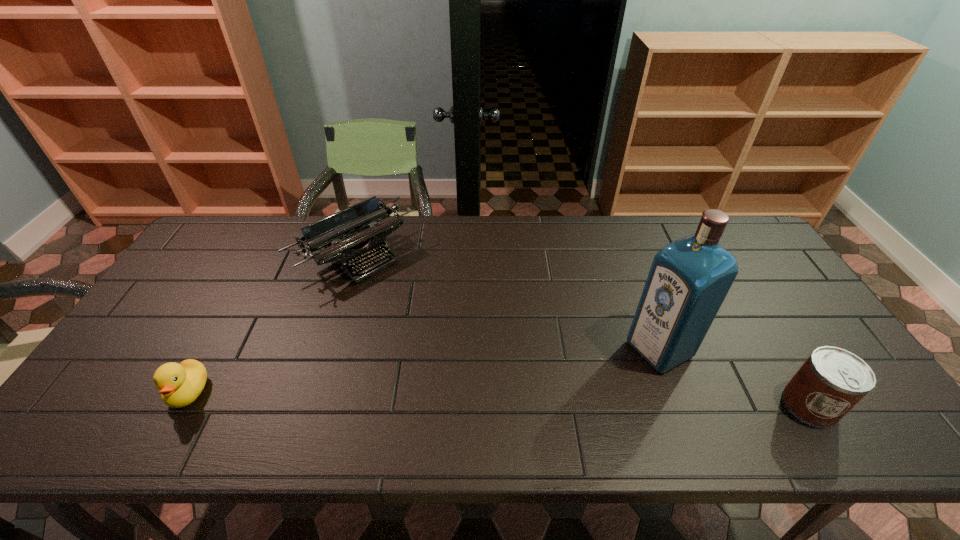
You are a GUI agent. You are given a task and a screenshot of the screen. Output one action in this format:
    pyautogui.click(x=<x>, y=<y>)
    Task: Click on the vacant space at the far edge
    
    Given the screenshot: What is the action you would take?
    pyautogui.click(x=495, y=222)

Locate an element on the screen. free space at the near edge of the desktop is located at coordinates (349, 386).

This screenshot has height=540, width=960. Identify the location of vacant space at the left edge of the desktop. (179, 337).

In the image, there is a desktop. Where is `free space at the right edge`? This screenshot has height=540, width=960. free space at the right edge is located at coordinates (780, 327).

Image resolution: width=960 pixels, height=540 pixels. I want to click on blank area at the far left corner, so [235, 235].

Locate an element on the screen. free region at the near left corner is located at coordinates (128, 403).

This screenshot has width=960, height=540. What are the coordinates of `vacant space at the far right corner` in the screenshot? It's located at (731, 219).

The height and width of the screenshot is (540, 960). What are the coordinates of `unoccupied area between the can and the duckling` in the screenshot? It's located at (499, 399).

Where is `free space that is in between the can and the typewriter`? free space that is in between the can and the typewriter is located at coordinates (584, 330).

Locate an element on the screen. vacant space that is in between the leftmost object and the typewriter is located at coordinates (273, 323).